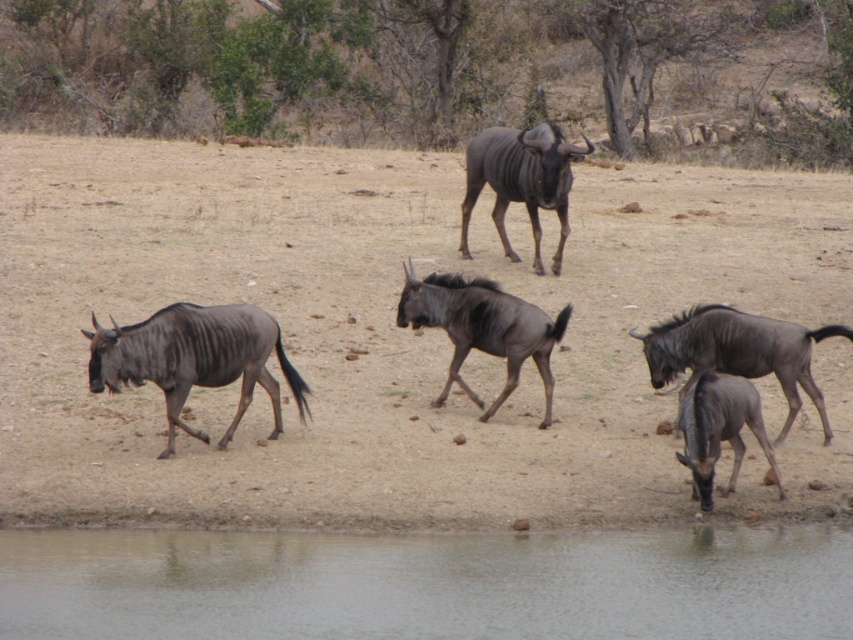
You are a wildebeest in the savanna and you want to drink water. You see the transparent water at lower center and the dark brown fur at right. Which one is closer to you?

The transparent water at lower center is closer to the viewer than the dark brown fur at right, so you should go towards the transparent water at lower center to drink.

You are a photographer standing at the edge of the savanna. You want to capture a photo of the gray matte antelope at lower right and the brown sandy ground at center in the same frame. Based on their heights, which object will appear larger in the photo?

The brown sandy ground at center will appear larger in the photo because it has a greater height compared to the gray matte antelope at lower right.